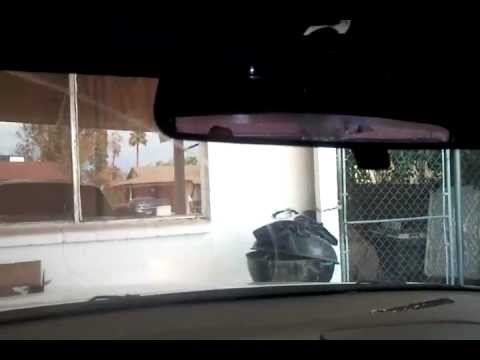
Find the location of `wall`. wall is located at coordinates (228, 198).